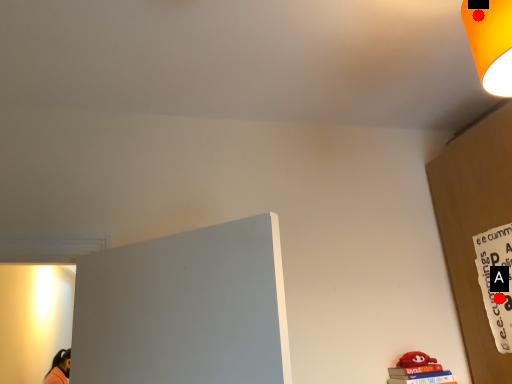
Question: Two points are circled on the image, labeled by A and B beside each circle. Which of the following is the farthest from the observer?

Choices:
 (A) A is further
 (B) B is further

Answer: (A)